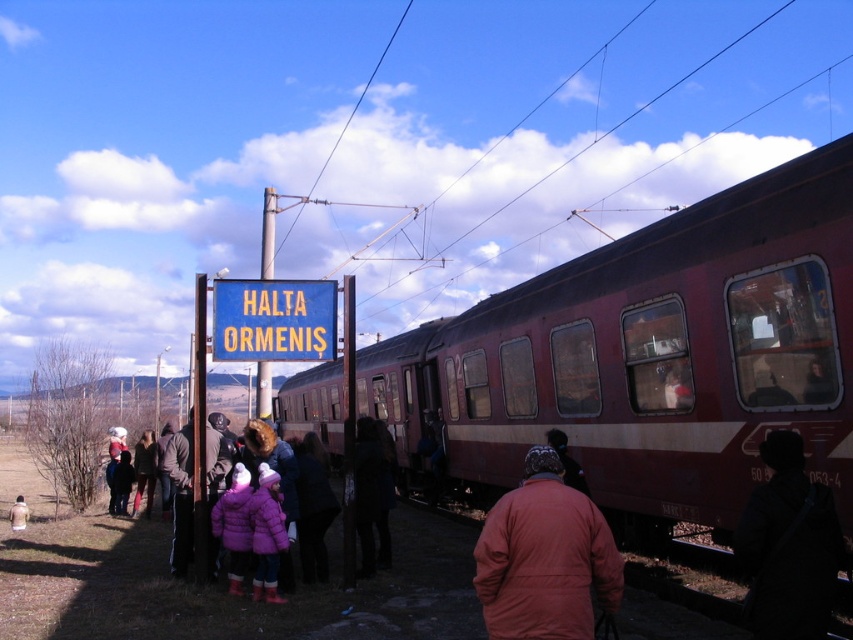
Question: Where is maroon metallic train at center located in relation to orange matte jacket at center in the image?

Choices:
 (A) below
 (B) above

Answer: (A)

Question: From the image, what is the correct spatial relationship of maroon metallic train at center in relation to orange matte jacket at center?

Choices:
 (A) left
 (B) right

Answer: (A)

Question: Which point is closer to the camera?

Choices:
 (A) (590, 524)
 (B) (689, 275)

Answer: (A)

Question: Is maroon metallic train at center wider than orange matte jacket at center?

Choices:
 (A) no
 (B) yes

Answer: (B)